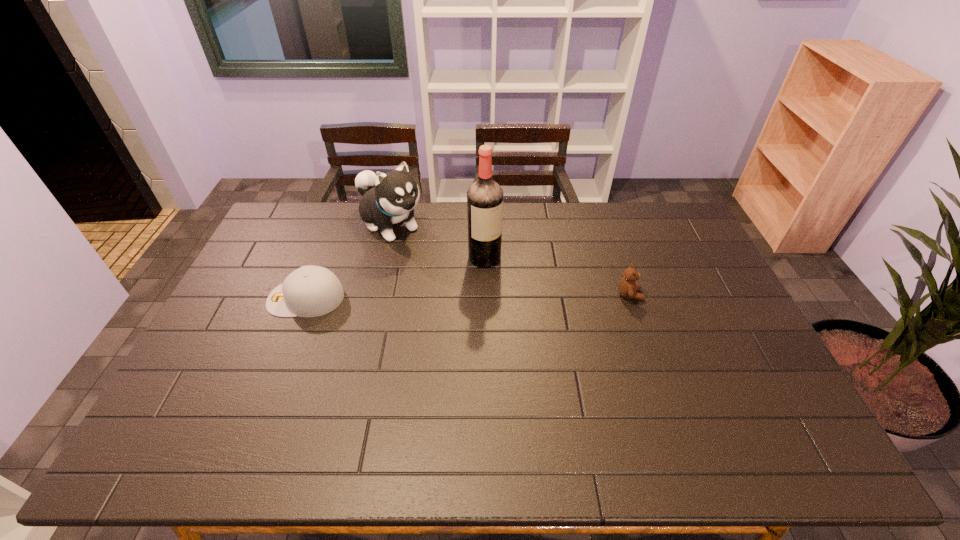
Find the location of a particular element. the shortest object is located at coordinates (309, 291).

Locate an element on the screen. teddy bear is located at coordinates (627, 286).

Locate an element on the screen. This screenshot has width=960, height=540. the third tallest object is located at coordinates (627, 286).

Identify the location of the second tallest object. (389, 198).

Image resolution: width=960 pixels, height=540 pixels. In order to click on liquor in this screenshot , I will do `click(484, 197)`.

Where is `the tallest object`? This screenshot has height=540, width=960. the tallest object is located at coordinates (484, 197).

The height and width of the screenshot is (540, 960). Find the location of `vacant area situated 0.100m on the front-facing side of the cap`. vacant area situated 0.100m on the front-facing side of the cap is located at coordinates (x=236, y=298).

Where is `vacant region located on the front-facing side of the cap`? The height and width of the screenshot is (540, 960). vacant region located on the front-facing side of the cap is located at coordinates (229, 298).

Locate an element on the screen. free region located on the front-facing side of the cap is located at coordinates (242, 298).

Where is `free space located 0.140m at the face of the teddy bear`? The height and width of the screenshot is (540, 960). free space located 0.140m at the face of the teddy bear is located at coordinates (687, 295).